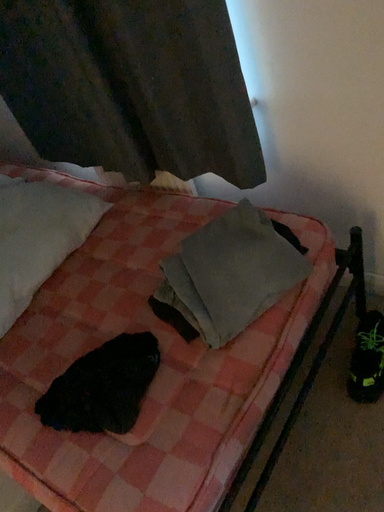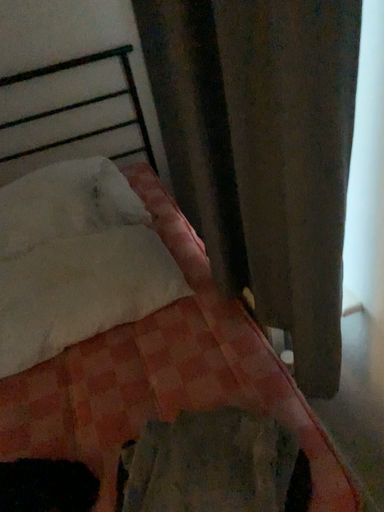
Question: How did the camera likely rotate when shooting the video?

Choices:
 (A) rotated right
 (B) rotated left

Answer: (B)